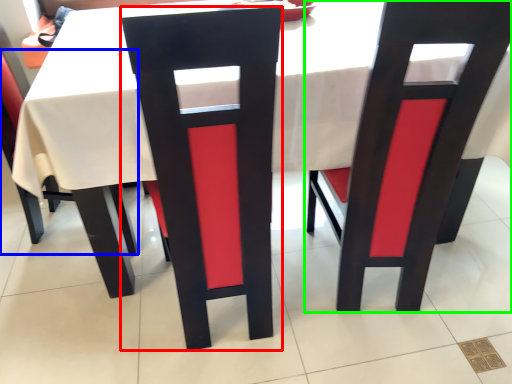
Question: Which object is positioned farthest from chair (highlighted by a red box)? Select from chair (highlighted by a blue box) and chair (highlighted by a green box).

Choices:
 (A) chair
 (B) chair

Answer: (A)